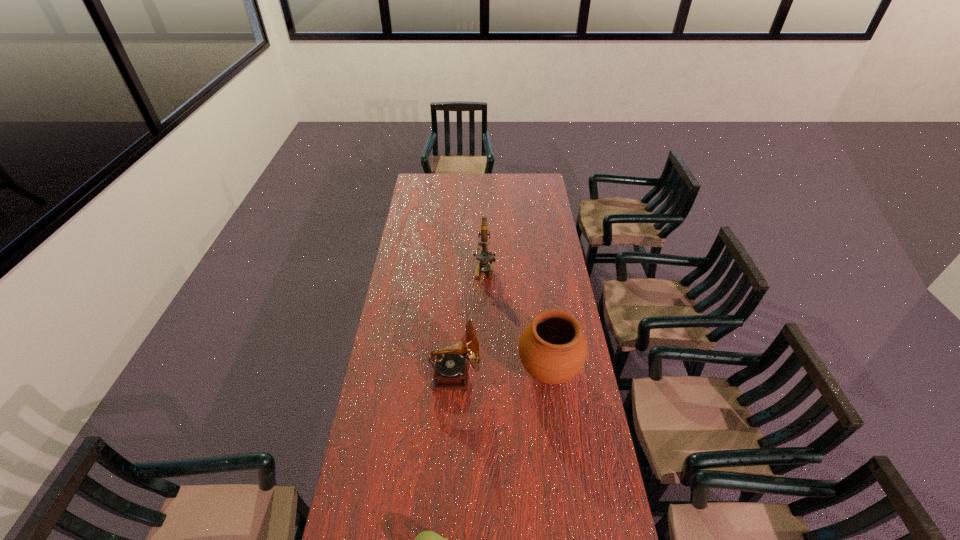
Locate an element on the screen. microscope is located at coordinates (484, 256).

Where is `phonograph_record`? The width and height of the screenshot is (960, 540). phonograph_record is located at coordinates (451, 368).

This screenshot has height=540, width=960. Find the location of `pottery`. pottery is located at coordinates (552, 348).

The height and width of the screenshot is (540, 960). In order to click on vacant space situated on the right of the farthest object in this screenshot , I will do `click(542, 270)`.

In order to click on free location located on the horn of the phonograph_record in this screenshot , I will do `click(566, 376)`.

In order to click on blank space located on the back of the rightmost object in this screenshot , I will do `click(539, 297)`.

At what (x,y) coordinates should I click in order to perform the action: click on object located at the right edge. Please return your answer as a coordinate pair (x, y). Looking at the image, I should click on (552, 348).

Find the location of a particular element. vacant space at the far edge of the desktop is located at coordinates (493, 181).

This screenshot has width=960, height=540. In the image, there is a desktop. In order to click on vacant space at the left edge in this screenshot , I will do `click(396, 403)`.

In the image, there is a desktop. Identify the location of vacant space at the right edge. (564, 307).